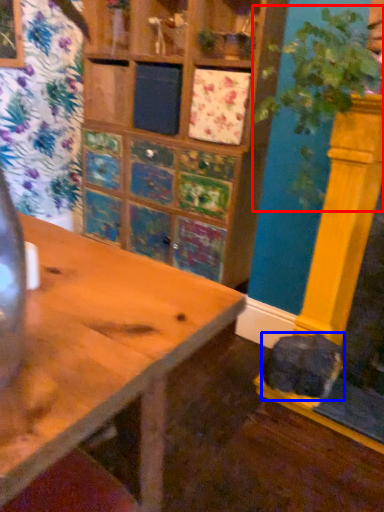
Question: Which point is closer to the camera, plant (highlighted by a red box) or animal (highlighted by a blue box)?

Choices:
 (A) plant
 (B) animal

Answer: (A)